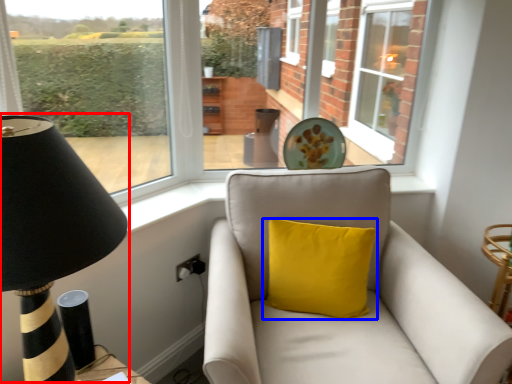
Question: Which of the following is the farthest to the observer, table lamp (highlighted by a red box) or pillow (highlighted by a blue box)?

Choices:
 (A) table lamp
 (B) pillow

Answer: (B)